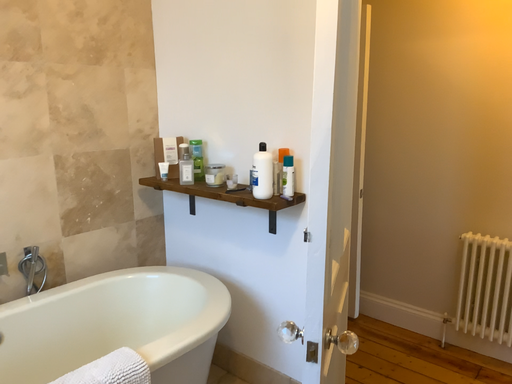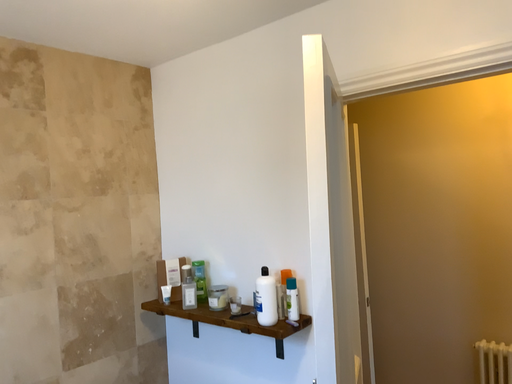
Question: How did the camera likely rotate when shooting the video?

Choices:
 (A) rotated upward
 (B) rotated downward

Answer: (A)